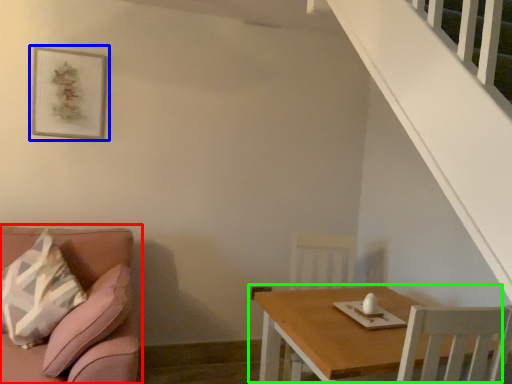
Question: Which object is the farthest from studio couch (highlighted by a red box)? Choose among these: picture frame (highlighted by a blue box) or table (highlighted by a green box).

Choices:
 (A) picture frame
 (B) table

Answer: (A)